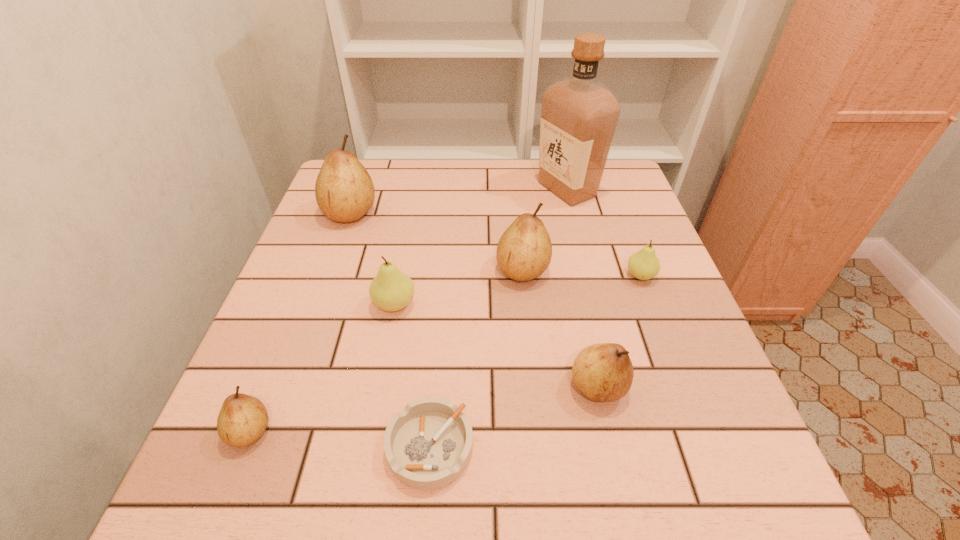
In order to click on object present at the far right corner in this screenshot , I will do `click(579, 114)`.

The image size is (960, 540). Identify the location of vacant space at the far edge. (439, 174).

Where is `free location at the near edge of the desktop`? The height and width of the screenshot is (540, 960). free location at the near edge of the desktop is located at coordinates (630, 491).

Where is `free space at the left edge of the desktop`? The width and height of the screenshot is (960, 540). free space at the left edge of the desktop is located at coordinates (332, 362).

This screenshot has width=960, height=540. In the image, there is a desktop. Find the location of `free space at the right edge`. free space at the right edge is located at coordinates (672, 294).

Where is `vacant space at the far left corner of the desktop`? Image resolution: width=960 pixels, height=540 pixels. vacant space at the far left corner of the desktop is located at coordinates pos(381,177).

I want to click on free point between the ashtray and the tallest object, so click(498, 318).

Identify the location of vacant space that's between the seventh shortest object and the liquor. Image resolution: width=960 pixels, height=540 pixels. pos(459,201).

You are a GUI agent. You are given a task and a screenshot of the screen. Output one action in this format:
    pyautogui.click(x=<x>, y=<y>)
    Task: Click on the unoccupied area between the third brown pear from left to right and the fourth pear from right to left
    
    Given the screenshot: What is the action you would take?
    pyautogui.click(x=459, y=287)

The image size is (960, 540). Find the location of `free point between the biggest brown pear and the rightmost brown pear`. free point between the biggest brown pear and the rightmost brown pear is located at coordinates (474, 300).